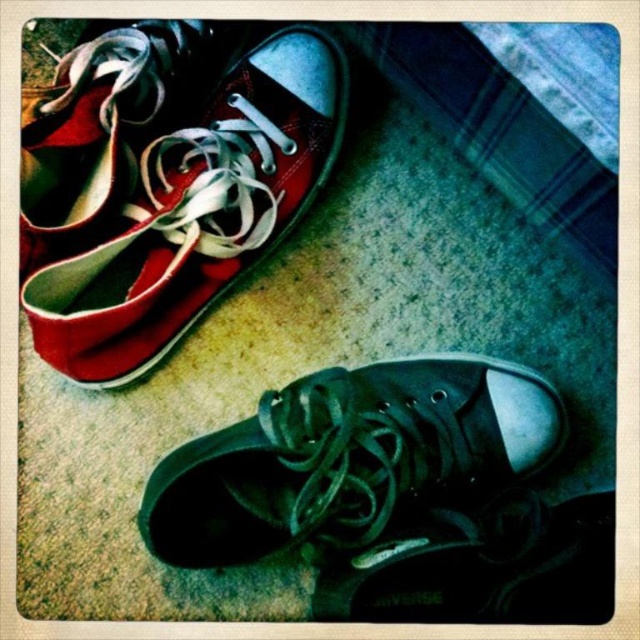
Question: Which of the following is the closest to the observer?

Choices:
 (A) (116, 84)
 (B) (45, 96)
 (C) (468, 368)

Answer: (A)

Question: Observing the image, what is the correct spatial positioning of matte canvas shoe at upper left in reference to matte white/red canvas shoe at upper left?

Choices:
 (A) right
 (B) left

Answer: (A)

Question: Among these points, which one is nearest to the camera?

Choices:
 (A) (189, 48)
 (B) (476, 408)
 (C) (301, 36)

Answer: (C)

Question: Does matte canvas shoe at upper left appear over matte white/red canvas shoe at upper left?

Choices:
 (A) no
 (B) yes

Answer: (A)

Question: Is matte canvas shoe at upper left in front of matte black sneaker at bottom right?

Choices:
 (A) no
 (B) yes

Answer: (B)

Question: Which object is positioned closest to the matte canvas shoe at upper left?

Choices:
 (A) matte black sneaker at bottom right
 (B) matte white/red canvas shoe at upper left

Answer: (B)